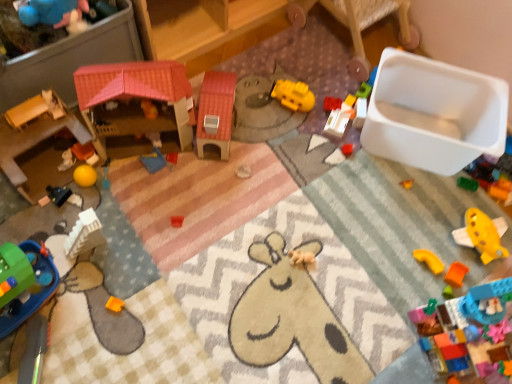
The height and width of the screenshot is (384, 512). I want to click on free space that is in between yellow plastic airplane at lower right, which appears as the first toy when viewed from the right, and smooth wooden dollhouse at left, the 1th toy in the left-to-right sequence, so click(282, 210).